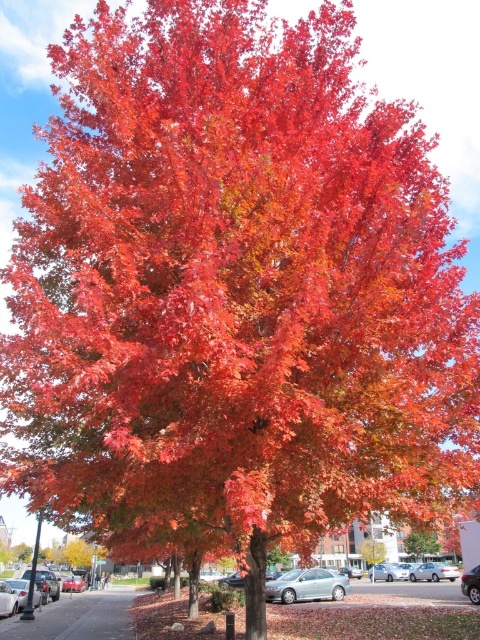
You are a pedestrian standing on the sidewalk and want to cross the street to reach the large tree. You see the satin silver sedan at lower center and the metallic silver car at center. Which car is closer to the large tree?

The satin silver sedan at lower center is closer to the large tree because it is positioned above the metallic silver car at center, meaning it is nearer in the scene.

In the scene shown: You are standing on the sidewalk in front of the satin silver sedan at center. If you want to walk directly to the tree with a canopy filled with leaves in shades of red, orange, and hints of green, which direction should you walk?

Since the satin silver sedan at center is located at point [307,586], walking towards the tree would require moving towards the lower left direction from the sedan.

You are standing on the sidewalk and want to cross the street to reach the large tree with autumn leaves. Is the satin silver sedan at center blocking your path directly in front of you?

The satin silver sedan at center is located at point (x=307, y=586), which means it is positioned directly in front of you on the street, blocking your path to the large tree with autumn leaves.